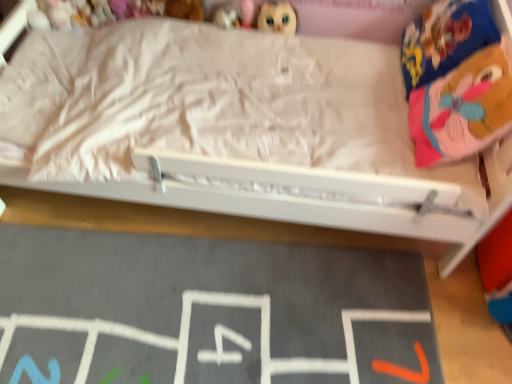
Image resolution: width=512 pixels, height=384 pixels. What do you see at coordinates (227, 16) in the screenshot?
I see `matte plastic toy at upper center, the second toy when ordered from right to left` at bounding box center [227, 16].

You are a GUI agent. You are given a task and a screenshot of the screen. Output one action in this format:
    pyautogui.click(x=<x>, y=<y>)
    Task: Click on the plush toy at upper left, the 1th toy from the left
    The image size is (512, 384).
    Given the screenshot: What is the action you would take?
    pyautogui.click(x=100, y=12)

Find the location of `white fabric bed at upper center`. white fabric bed at upper center is located at coordinates (308, 205).

Locate an element on the screen. This screenshot has width=512, height=384. pink fabric pillow at upper right is located at coordinates (462, 106).

This screenshot has width=512, height=384. Describe the element at coordinates (277, 17) in the screenshot. I see `matte plastic doll at upper center, positioned as the 4th toy in left-to-right order` at that location.

In order to face matte plastic doll at upper center, the first toy positioned from the right, should I rotate leftwards or rightwards?

Rotate right and turn 2.985 degrees.

Find the location of a particular element. matte plastic toy at upper center, the second toy when ordered from right to left is located at coordinates (227, 16).

Is point (225, 10) closer or farther from the camera than point (105, 21)?

Point (225, 10) is closer to the camera than point (105, 21).

From the image's perspective, is matte plastic toy at upper center, the second toy when ordered from right to left, on plush toy at upper left, the 1th toy from the left?

Incorrect, from the image's perspective, matte plastic toy at upper center, the second toy when ordered from right to left, is lower than plush toy at upper left, the 1th toy from the left.

Does matte plastic toy at upper center, the second toy when ordered from right to left, come behind plush toy at upper left, the 1th toy from the left?

That is False.

Is matte plastic doll at upper center, the first toy positioned from the right, touching white fabric bed at upper center?

No, matte plastic doll at upper center, the first toy positioned from the right, is not beside white fabric bed at upper center.

Is the depth of matte plastic doll at upper center, the first toy positioned from the right, greater than that of white fabric bed at upper center?

Yes.

Is matte plastic doll at upper center, the first toy positioned from the right, taller than white fabric bed at upper center?

Yes.

Is matte plastic doll at upper center, the first toy positioned from the right, to the left of white fabric bed at upper center from the viewer's perspective?

No.

Considering the positions of objects white fabric bed at upper center and soft plush bear at upper center, the third toy when ordered from right to left, in the image provided, who is more to the right, white fabric bed at upper center or soft plush bear at upper center, the third toy when ordered from right to left,?

white fabric bed at upper center is more to the right.

Identify the location of toy that is the 2nd one when counting leftward from the white fabric bed at upper center. The width and height of the screenshot is (512, 384). (184, 9).

Is white fabric bed at upper center not near soft plush bear at upper center, the second toy in the left-to-right sequence?

No.

Does white fabric bed at upper center have a lesser width compared to soft plush bear at upper center, the third toy when ordered from right to left?

No, white fabric bed at upper center is not thinner than soft plush bear at upper center, the third toy when ordered from right to left.

Between black chalkboard at lower center and plush toy at upper left, which is the 4th toy in right-to-left order, which one appears on the right side from the viewer's perspective?

Positioned to the right is black chalkboard at lower center.

Would you say black chalkboard at lower center is a long distance from plush toy at upper left, the 1th toy from the left?

Result: black chalkboard at lower center is far away from plush toy at upper left, the 1th toy from the left.

Is point (106, 321) more distant than point (103, 14)?

No, it is not.

Is black chalkboard at lower center surrounded by matte plastic toy at upper center, the second toy when ordered from right to left?

That's incorrect, black chalkboard at lower center is not inside matte plastic toy at upper center, the second toy when ordered from right to left.

Based on their positions, is matte plastic toy at upper center, acting as the third toy starting from the left, located to the left or right of black chalkboard at lower center?

From the image, it's evident that matte plastic toy at upper center, acting as the third toy starting from the left, is to the right of black chalkboard at lower center.

Between point (219, 15) and point (75, 286), which one is positioned behind?

Point (219, 15)

Are matte plastic toy at upper center, the second toy when ordered from right to left, and black chalkboard at lower center located far from each other?

Yes.

From the picture: From the image's perspective, is soft plush bear at upper center, the second toy in the left-to-right sequence, beneath plush toy at upper left, the 1th toy from the left?

Actually, soft plush bear at upper center, the second toy in the left-to-right sequence, appears above plush toy at upper left, the 1th toy from the left, in the image.

From a real-world perspective, is soft plush bear at upper center, the second toy in the left-to-right sequence, physically below plush toy at upper left, the 1th toy from the left?

No, from a real-world perspective, soft plush bear at upper center, the second toy in the left-to-right sequence, is not under plush toy at upper left, the 1th toy from the left.

Is soft plush bear at upper center, the third toy when ordered from right to left, positioned with its back to plush toy at upper left, which is the 4th toy in right-to-left order?

No, soft plush bear at upper center, the third toy when ordered from right to left,'s orientation is not away from plush toy at upper left, which is the 4th toy in right-to-left order.

Looking at the image, does plush toy at upper left, which is the 4th toy in right-to-left order, seem bigger or smaller compared to matte plastic doll at upper center, the first toy positioned from the right?

In the image, plush toy at upper left, which is the 4th toy in right-to-left order, appears to be smaller than matte plastic doll at upper center, the first toy positioned from the right.

Which is correct: plush toy at upper left, the 1th toy from the left, is inside matte plastic doll at upper center, positioned as the 4th toy in left-to-right order, or outside of it?

plush toy at upper left, the 1th toy from the left, is outside matte plastic doll at upper center, positioned as the 4th toy in left-to-right order.

Is plush toy at upper left, which is the 4th toy in right-to-left order, oriented away from matte plastic doll at upper center, positioned as the 4th toy in left-to-right order?

That's not correct — plush toy at upper left, which is the 4th toy in right-to-left order, is not looking away from matte plastic doll at upper center, positioned as the 4th toy in left-to-right order.

Looking at this image, does plush toy at upper left, the 1th toy from the left, have a lesser width compared to matte plastic doll at upper center, positioned as the 4th toy in left-to-right order?

Yes, plush toy at upper left, the 1th toy from the left, is thinner than matte plastic doll at upper center, positioned as the 4th toy in left-to-right order.

Identify the location of the 2nd toy to the left when counting from the matte plastic toy at upper center, the second toy when ordered from right to left. (100, 12).

You are a GUI agent. You are given a task and a screenshot of the screen. Output one action in this format:
    pyautogui.click(x=<x>, y=<y>)
    Task: Click on the toy that is the 2nd object located behind the white fabric bed at upper center
    This screenshot has width=512, height=384.
    Given the screenshot: What is the action you would take?
    pyautogui.click(x=277, y=17)

Considering their positions, is soft plush bear at upper center, the second toy in the left-to-right sequence, positioned closer to white fabric bed at upper center than matte plastic toy at upper center, acting as the third toy starting from the left?

The object closer to white fabric bed at upper center is matte plastic toy at upper center, acting as the third toy starting from the left.

From the image, which object appears to be nearer to plush toy at upper left, which is the 4th toy in right-to-left order, matte plastic doll at upper center, positioned as the 4th toy in left-to-right order, or white fabric bed at upper center?

matte plastic doll at upper center, positioned as the 4th toy in left-to-right order, is positioned closer to the anchor plush toy at upper left, which is the 4th toy in right-to-left order.

Estimate the real-world distances between objects in this image. Which object is further from matte plastic toy at upper center, acting as the third toy starting from the left, soft plush bear at upper center, the third toy when ordered from right to left, or black chalkboard at lower center?

Based on the image, black chalkboard at lower center appears to be further to matte plastic toy at upper center, acting as the third toy starting from the left.

Which object lies further to the anchor point plush toy at upper left, which is the 4th toy in right-to-left order, pink fabric pillow at upper right or matte plastic toy at upper center, acting as the third toy starting from the left?

Among the two, pink fabric pillow at upper right is located further to plush toy at upper left, which is the 4th toy in right-to-left order.

When comparing their distances from soft plush bear at upper center, the second toy in the left-to-right sequence, does plush toy at upper left, which is the 4th toy in right-to-left order, or black chalkboard at lower center seem further?

black chalkboard at lower center is positioned further to the anchor soft plush bear at upper center, the second toy in the left-to-right sequence.

Looking at the image, which one is located further to matte plastic doll at upper center, positioned as the 4th toy in left-to-right order, black chalkboard at lower center or white fabric bed at upper center?

Based on the image, black chalkboard at lower center appears to be further to matte plastic doll at upper center, positioned as the 4th toy in left-to-right order.

Estimate the real-world distances between objects in this image. Which object is closer to white fabric bed at upper center, plush toy at upper left, the 1th toy from the left, or pink fabric pillow at upper right?

pink fabric pillow at upper right is positioned closer to the anchor white fabric bed at upper center.

From the image, which object appears to be nearer to black chalkboard at lower center, matte plastic toy at upper center, the second toy when ordered from right to left, or pink fabric pillow at upper right?

pink fabric pillow at upper right is closer to black chalkboard at lower center.

The width and height of the screenshot is (512, 384). What are the coordinates of `stuff between matte plastic toy at upper center, the second toy when ordered from right to left, and white fabric bed at upper center, in the vertical direction` in the screenshot? It's located at (462, 106).

Where is `bed between pink fabric pillow at upper right and black chalkboard at lower center from top to bottom`? bed between pink fabric pillow at upper right and black chalkboard at lower center from top to bottom is located at coordinates (308, 205).

Find the location of a particular element. The image size is (512, 384). toy between matte plastic toy at upper center, acting as the third toy starting from the left, and white fabric bed at upper center from top to bottom is located at coordinates (277, 17).

Image resolution: width=512 pixels, height=384 pixels. What are the coordinates of `bed between plush toy at upper left, the 1th toy from the left, and black chalkboard at lower center in the up-down direction` in the screenshot? It's located at (308, 205).